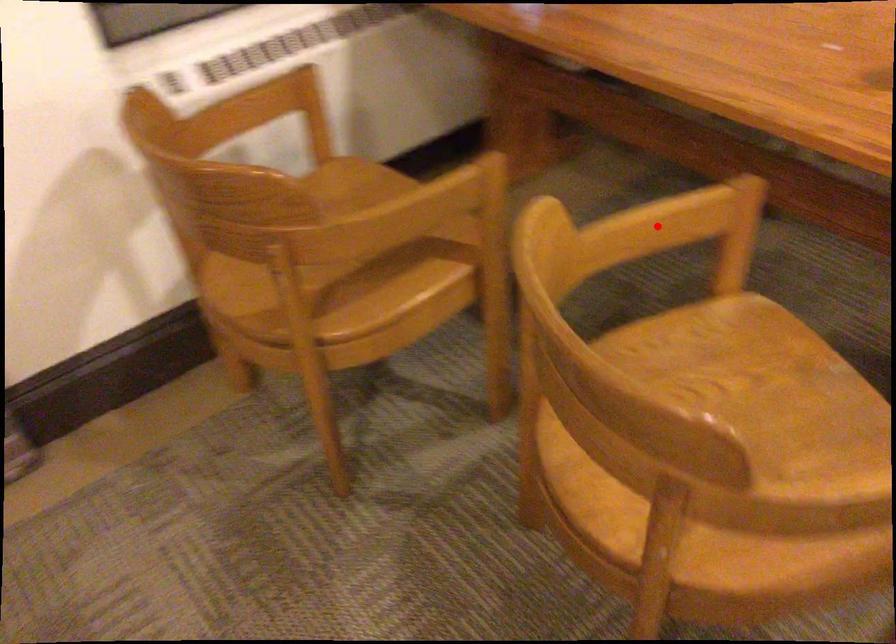
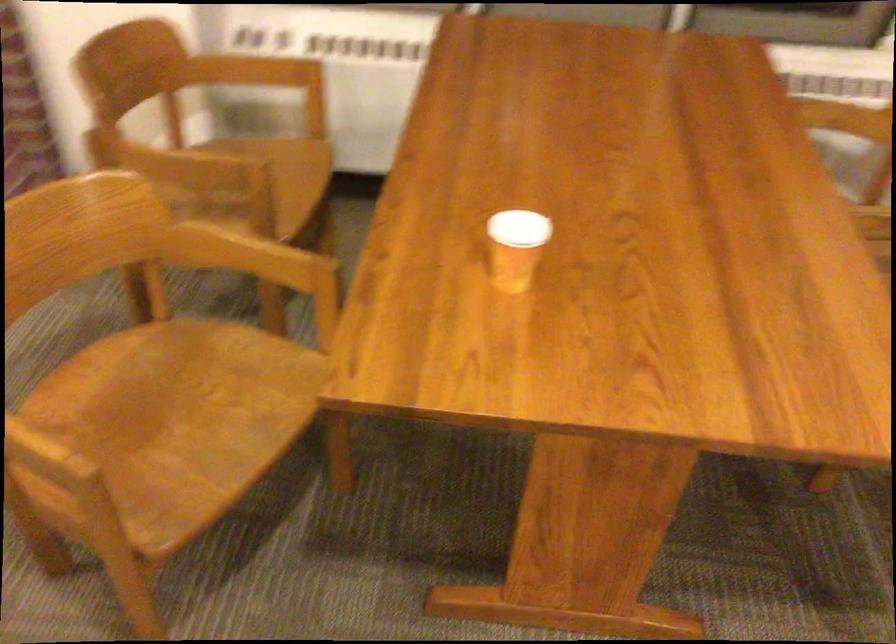
Question: I am providing you with two images of the same scene from different viewpoints. A red point is shown in image1. For the corresponding object point in image2, is it positioned nearer or farther from the camera?

Choices:
 (A) Nearer
 (B) Farther

Answer: (B)